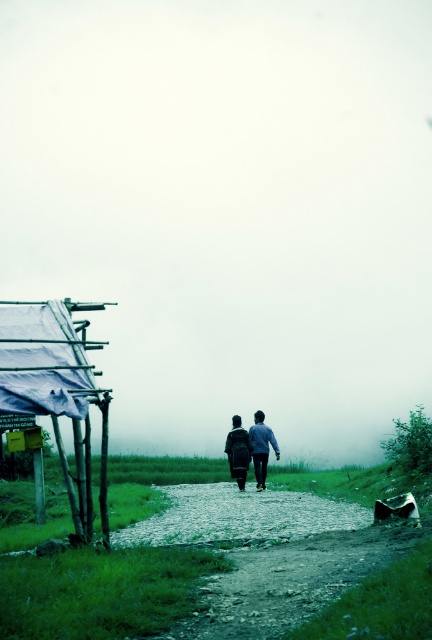
Question: From the image, what is the correct spatial relationship of matte black backpack at center in relation to dark blue fabric jacket at center?

Choices:
 (A) left
 (B) right

Answer: (B)

Question: Does matte black backpack at center have a larger size compared to dark blue fabric jacket at center?

Choices:
 (A) yes
 (B) no

Answer: (A)

Question: Which object appears farthest from the camera in this image?

Choices:
 (A) matte black backpack at center
 (B) dark blue fabric jacket at center

Answer: (B)

Question: In this image, where is matte black backpack at center located relative to dark blue fabric jacket at center?

Choices:
 (A) below
 (B) above

Answer: (B)